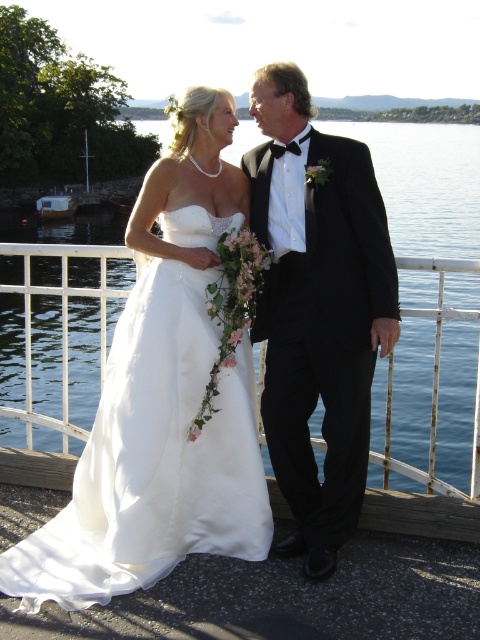
Does satin/sheen wedding dress at center have a lesser width compared to black satin tuxedo at center?

Incorrect, satin/sheen wedding dress at center's width is not less than black satin tuxedo at center's.

Between satin/sheen wedding dress at center and black satin tuxedo at center, which one is positioned higher?

black satin tuxedo at center is higher up.

Locate an element on the screen. The image size is (480, 640). satin/sheen wedding dress at center is located at coordinates (154, 458).

The height and width of the screenshot is (640, 480). What are the coordinates of `satin/sheen wedding dress at center` in the screenshot? It's located at (154, 458).

Is point (220, 465) positioned behind point (383, 467)?

No, (220, 465) is closer to viewer.

Who is lower down, satin/sheen wedding dress at center or white metal railing at center?

satin/sheen wedding dress at center is below.

Image resolution: width=480 pixels, height=640 pixels. In order to click on satin/sheen wedding dress at center in this screenshot , I will do click(x=154, y=458).

Is the position of black satin tuxedo at center more distant than that of white metal railing at center?

That is False.

The width and height of the screenshot is (480, 640). Find the location of `black satin tuxedo at center`. black satin tuxedo at center is located at coordinates (317, 308).